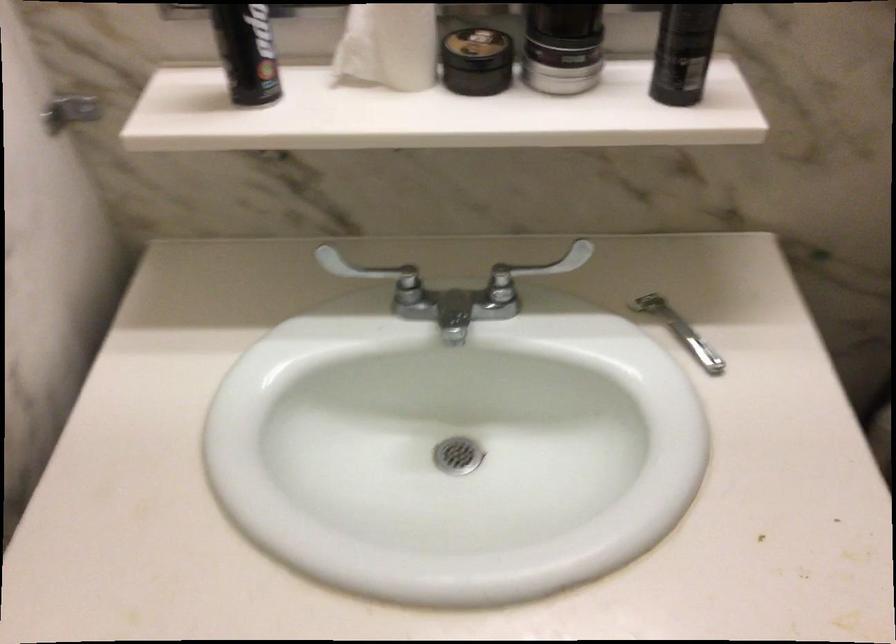
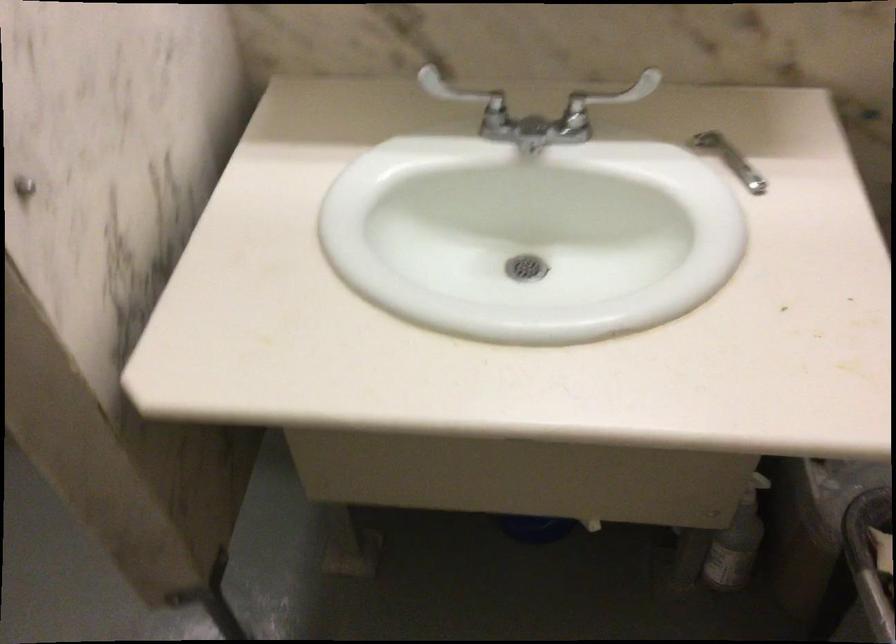
Find the pixel in the second image that matches point 540,252 in the first image.

(608, 98)